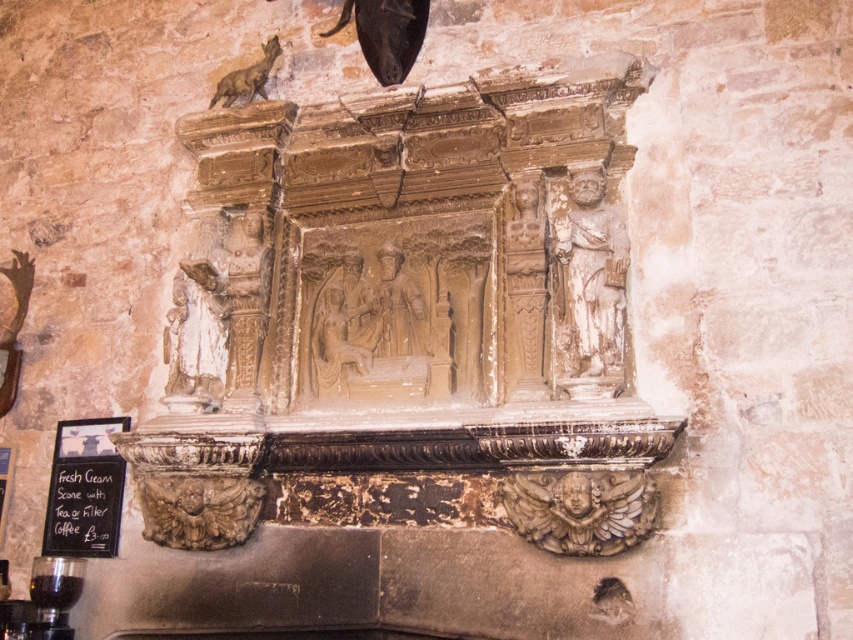
Is point (604, 268) farther from viewer compared to point (318, 358)?

No.

Who is more distant from viewer, (598, 202) or (341, 317)?

The point (341, 317) is more distant.

Locate an element on the screen. This screenshot has height=640, width=853. carved stone figure at right is located at coordinates (592, 284).

Which of these two, carved stone figure at center or bronze wolf at upper left, stands shorter?

With less height is bronze wolf at upper left.

Is carved stone figure at center positioned at the back of bronze wolf at upper left?

No, carved stone figure at center is in front of bronze wolf at upper left.

The image size is (853, 640). What are the coordinates of `carved stone figure at center` in the screenshot? It's located at (396, 305).

Between point (332, 371) and point (263, 70), which one is positioned in front?

Point (332, 371) is in front.

Does beige stone relief at center have a larger size compared to bronze wolf at upper left?

Indeed, beige stone relief at center has a larger size compared to bronze wolf at upper left.

Identify the location of beige stone relief at center. The image size is (853, 640). (338, 339).